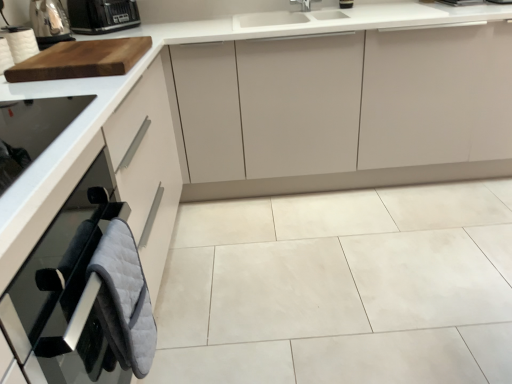
Question: Can you confirm if metallic silver toaster at upper left is positioned to the right of matte white cabinet at center, which is the 2th cabinetry in front-to-back order?

Choices:
 (A) yes
 (B) no

Answer: (B)

Question: From a real-world perspective, is metallic silver toaster at upper left below matte white cabinet at center, the 1th cabinetry viewed from the back?

Choices:
 (A) yes
 (B) no

Answer: (B)

Question: Can you confirm if metallic silver toaster at upper left is wider than matte white cabinet at center, positioned as the first cabinetry in top-to-bottom order?

Choices:
 (A) yes
 (B) no

Answer: (B)

Question: From the image's perspective, is metallic silver toaster at upper left located beneath matte white cabinet at center, the 1th cabinetry viewed from the back?

Choices:
 (A) yes
 (B) no

Answer: (B)

Question: Does metallic silver toaster at upper left have a lesser height compared to matte white cabinet at center, marked as the 2th cabinetry in a bottom-to-top arrangement?

Choices:
 (A) no
 (B) yes

Answer: (B)

Question: Is metallic silver toaster at upper left positioned in front of matte white cabinet at center, positioned as the first cabinetry in top-to-bottom order?

Choices:
 (A) no
 (B) yes

Answer: (B)

Question: Considering the relative sizes of matte white cabinet at center, which is the 2th cabinetry in front-to-back order, and black plastic toaster at upper left in the image provided, is matte white cabinet at center, which is the 2th cabinetry in front-to-back order, wider than black plastic toaster at upper left?

Choices:
 (A) yes
 (B) no

Answer: (A)

Question: Can you confirm if matte white cabinet at center, which is the 2th cabinetry in front-to-back order, is thinner than black plastic toaster at upper left?

Choices:
 (A) no
 (B) yes

Answer: (A)

Question: Considering the relative sizes of matte white cabinet at center, which is the 2th cabinetry in front-to-back order, and black plastic toaster at upper left in the image provided, is matte white cabinet at center, which is the 2th cabinetry in front-to-back order, shorter than black plastic toaster at upper left?

Choices:
 (A) no
 (B) yes

Answer: (A)

Question: Considering the relative sizes of matte white cabinet at center, positioned as the first cabinetry in top-to-bottom order, and black plastic toaster at upper left in the image provided, is matte white cabinet at center, positioned as the first cabinetry in top-to-bottom order, taller than black plastic toaster at upper left?

Choices:
 (A) yes
 (B) no

Answer: (A)

Question: Can we say matte white cabinet at center, which is the 2th cabinetry in front-to-back order, lies outside black plastic toaster at upper left?

Choices:
 (A) no
 (B) yes

Answer: (B)

Question: Does matte white cabinet at center, the 1th cabinetry viewed from the back, lie in front of black plastic toaster at upper left?

Choices:
 (A) no
 (B) yes

Answer: (B)

Question: Is white paper towel at upper left completely or partially inside white ceramic tile at center?

Choices:
 (A) no
 (B) yes

Answer: (A)